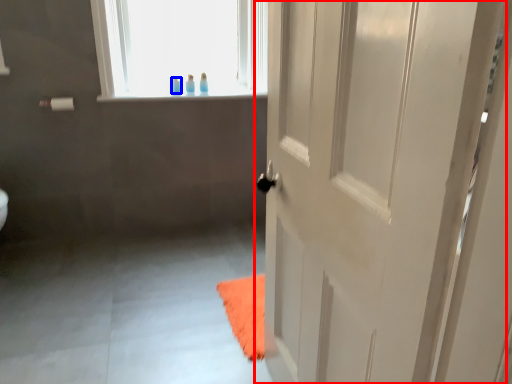
Question: Which of the following is the farthest to the observer, door (highlighted by a red box) or toiletry (highlighted by a blue box)?

Choices:
 (A) door
 (B) toiletry

Answer: (B)